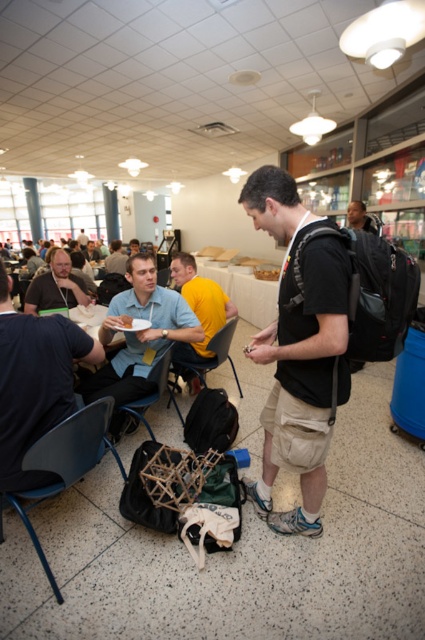
Does dark gray shirt at left have a greater height compared to metallic gray chair at lower center?

Yes.

Can you confirm if dark gray shirt at left is positioned to the right of metallic gray chair at lower center?

Incorrect, dark gray shirt at left is not on the right side of metallic gray chair at lower center.

The width and height of the screenshot is (425, 640). What are the coordinates of `dark gray shirt at left` in the screenshot? It's located at (34, 384).

I want to click on dark gray shirt at left, so click(x=34, y=384).

Between matte blue shirt at center and matte black backpack at center, which one has more height?

matte blue shirt at center

Between matte blue shirt at center and matte black backpack at center, which one has less height?

Standing shorter between the two is matte black backpack at center.

Between point (129, 355) and point (351, 209), which one is positioned behind?

Positioned behind is point (351, 209).

Locate an element on the screen. matte blue shirt at center is located at coordinates (138, 337).

Describe the element at coordinates (204, 362) in the screenshot. I see `blue plastic chair at center` at that location.

Between point (227, 330) and point (348, 214), which one is positioned behind?

Positioned behind is point (348, 214).

Is point (214, 356) positioned after point (371, 230)?

No, it is in front of (371, 230).

Where is `blue plastic chair at center`? blue plastic chair at center is located at coordinates (204, 362).